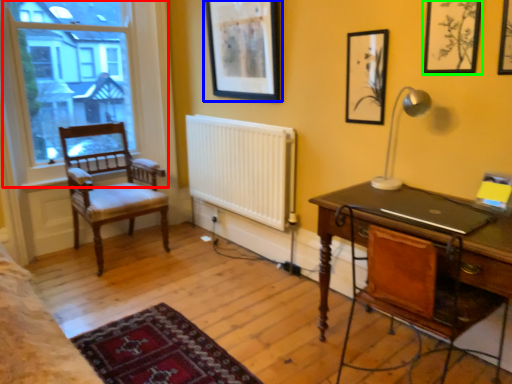
Question: Which object is positioned farthest from window (highlighted by a red box)? Select from picture frame (highlighted by a blue box) and picture frame (highlighted by a green box).

Choices:
 (A) picture frame
 (B) picture frame

Answer: (B)